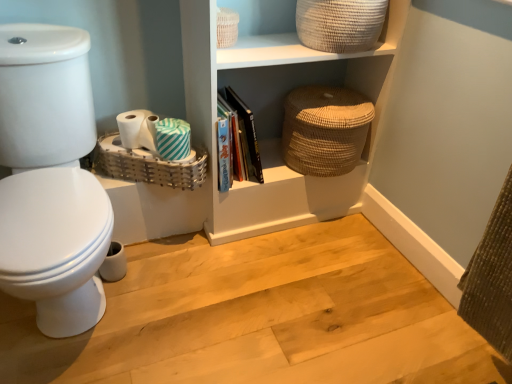
Question: Can you confirm if teal striped toilet paper at center, the second toilet paper from the left, is positioned to the right of beige woven basket at upper center, which is the 2th basket from left to right?

Choices:
 (A) no
 (B) yes

Answer: (A)

Question: From a real-world perspective, is teal striped toilet paper at center, arranged as the 2th toilet paper when viewed from the right, positioned under beige woven basket at upper center, which is the 2th basket from left to right, based on gravity?

Choices:
 (A) no
 (B) yes

Answer: (B)

Question: Considering the relative positions of teal striped toilet paper at center, the second toilet paper from the left, and beige woven basket at upper center, the 2th basket from the right, in the image provided, is teal striped toilet paper at center, the second toilet paper from the left, to the left of beige woven basket at upper center, the 2th basket from the right, from the viewer's perspective?

Choices:
 (A) no
 (B) yes

Answer: (B)

Question: Could you tell me if teal striped toilet paper at center, the second toilet paper from the left, is facing beige woven basket at upper center, the 2th basket from the right?

Choices:
 (A) yes
 (B) no

Answer: (B)

Question: Is teal striped toilet paper at center, arranged as the 2th toilet paper when viewed from the right, directly adjacent to beige woven basket at upper center, the 2th basket from the right?

Choices:
 (A) yes
 (B) no

Answer: (B)

Question: Considering the relative sizes of teal striped toilet paper at center, the second toilet paper from the left, and beige woven basket at upper center, which is the 2th basket from left to right, in the image provided, is teal striped toilet paper at center, the second toilet paper from the left, taller than beige woven basket at upper center, which is the 2th basket from left to right,?

Choices:
 (A) no
 (B) yes

Answer: (A)

Question: Does woven beige basket at upper right, the first basket viewed from the right, have a lesser width compared to teal striped toilet paper at center, the second toilet paper from the left?

Choices:
 (A) yes
 (B) no

Answer: (B)

Question: Is the position of woven beige basket at upper right, the first basket viewed from the right, less distant than that of teal striped toilet paper at center, arranged as the 2th toilet paper when viewed from the right?

Choices:
 (A) no
 (B) yes

Answer: (B)

Question: From the image's perspective, would you say woven beige basket at upper right, the first basket viewed from the right, is shown under teal striped toilet paper at center, arranged as the 2th toilet paper when viewed from the right?

Choices:
 (A) yes
 (B) no

Answer: (B)

Question: Considering the relative positions of woven beige basket at upper right, the 3th basket when ordered from left to right, and teal striped toilet paper at center, the second toilet paper from the left, in the image provided, is woven beige basket at upper right, the 3th basket when ordered from left to right, behind teal striped toilet paper at center, the second toilet paper from the left,?

Choices:
 (A) no
 (B) yes

Answer: (A)

Question: Would you say woven beige basket at upper right, the first basket viewed from the right, contains teal striped toilet paper at center, the second toilet paper from the left?

Choices:
 (A) yes
 (B) no

Answer: (B)

Question: Considering the relative sizes of woven beige basket at upper right, the first basket viewed from the right, and teal striped toilet paper at center, the second toilet paper from the left, in the image provided, is woven beige basket at upper right, the first basket viewed from the right, smaller than teal striped toilet paper at center, the second toilet paper from the left,?

Choices:
 (A) yes
 (B) no

Answer: (B)

Question: Is white matte toilet paper at lower left, which ranks as the 1th toilet paper in left-to-right order, shorter than beige woven basket at upper center, which is the 2th basket from left to right?

Choices:
 (A) yes
 (B) no

Answer: (A)